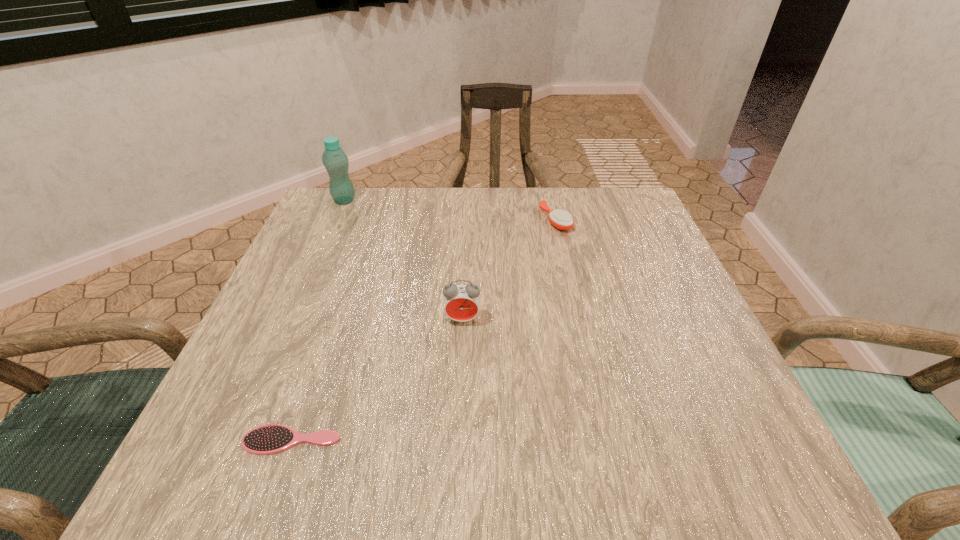
Where is `the farthest object`? The width and height of the screenshot is (960, 540). the farthest object is located at coordinates (x=334, y=159).

Where is `water bottle`? The height and width of the screenshot is (540, 960). water bottle is located at coordinates (334, 159).

This screenshot has height=540, width=960. Identify the location of the third object from left to right. (461, 301).

Where is `the second nearest object`? Image resolution: width=960 pixels, height=540 pixels. the second nearest object is located at coordinates (461, 301).

Where is `the right hairbrush`? This screenshot has width=960, height=540. the right hairbrush is located at coordinates (560, 219).

At what (x,y) coordinates should I click in order to perform the action: click on the farther hairbrush. Please return your answer as a coordinate pair (x, y). This screenshot has height=540, width=960. Looking at the image, I should click on (560, 219).

Locate an element on the screen. The height and width of the screenshot is (540, 960). the shortest object is located at coordinates (268, 439).

This screenshot has height=540, width=960. What are the coordinates of `the nearer hairbrush` in the screenshot? It's located at (268, 439).

At what (x,y) coordinates should I click in order to perform the action: click on free spot located 0.180m at the front cap of the water bottle. Please return your answer as a coordinate pair (x, y). This screenshot has height=540, width=960. Looking at the image, I should click on (425, 200).

This screenshot has width=960, height=540. Identify the location of free spot located on the face of the second object from right to left. (456, 480).